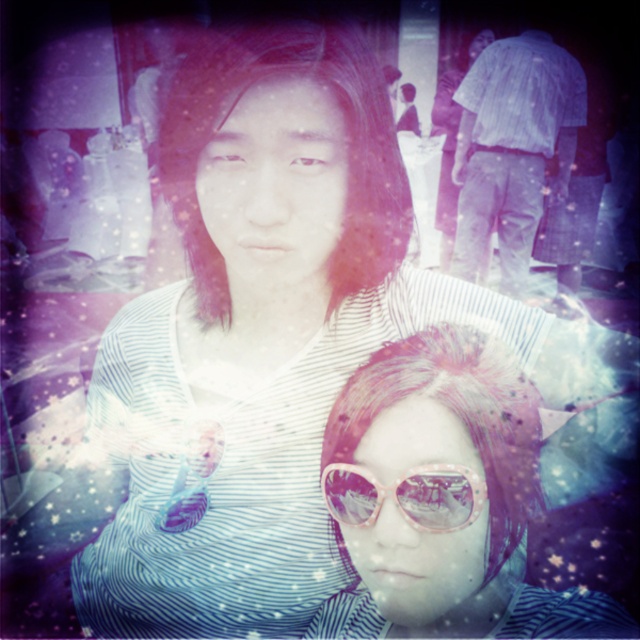
Question: Is light blue striped shirt at upper right above pink shiny sunglasses at center?

Choices:
 (A) yes
 (B) no

Answer: (A)

Question: Which point appears farthest from the camera in this image?

Choices:
 (A) (410, 515)
 (B) (422, 378)

Answer: (B)

Question: Which point is closer to the camera?

Choices:
 (A) light blue striped shirt at upper right
 (B) pink shiny sunglasses at center
 (C) pink plastic sunglasses at center

Answer: (C)

Question: From the image, what is the correct spatial relationship of pink plastic sunglasses at center in relation to pink shiny sunglasses at center?

Choices:
 (A) left
 (B) right

Answer: (B)

Question: Estimate the real-world distances between objects in this image. Which object is farther from the pink shiny sunglasses at center?

Choices:
 (A) pink plastic sunglasses at center
 (B) light blue striped shirt at upper right

Answer: (B)

Question: Is the position of pink plastic sunglasses at center less distant than that of light blue striped shirt at upper right?

Choices:
 (A) yes
 (B) no

Answer: (A)